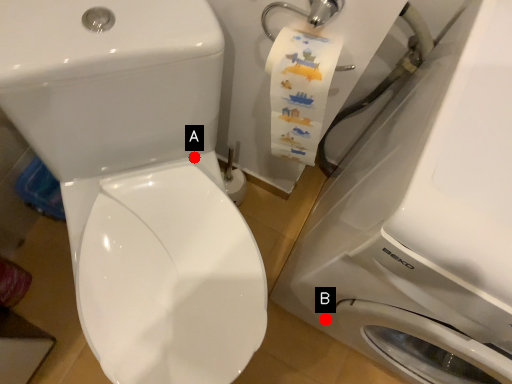
Question: Two points are circled on the image, labeled by A and B beside each circle. Which point is further to the camera?

Choices:
 (A) A is further
 (B) B is further

Answer: (B)